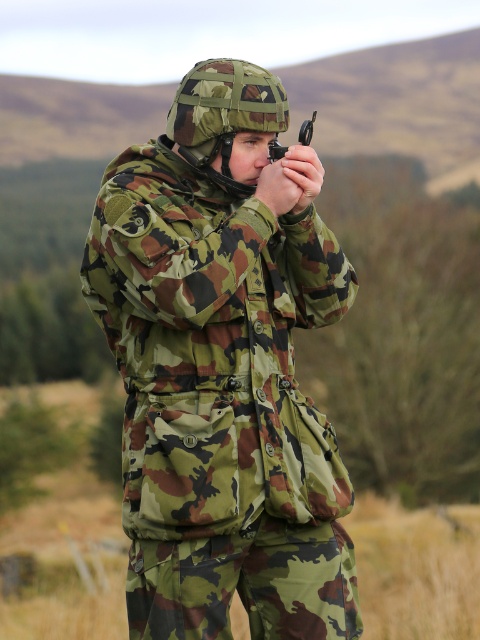
Question: Which of the following is the farthest from the observer?

Choices:
 (A) matte black scope at center
 (B) camo fabric uniform at center

Answer: (B)

Question: Among these objects, which one is nearest to the camera?

Choices:
 (A) matte black scope at center
 (B) camo fabric uniform at center

Answer: (A)

Question: Is camo fabric uniform at center further to camera compared to matte black scope at center?

Choices:
 (A) no
 (B) yes

Answer: (B)

Question: Is camo fabric uniform at center below matte black scope at center?

Choices:
 (A) no
 (B) yes

Answer: (B)

Question: Is camo fabric uniform at center wider than matte black scope at center?

Choices:
 (A) yes
 (B) no

Answer: (A)